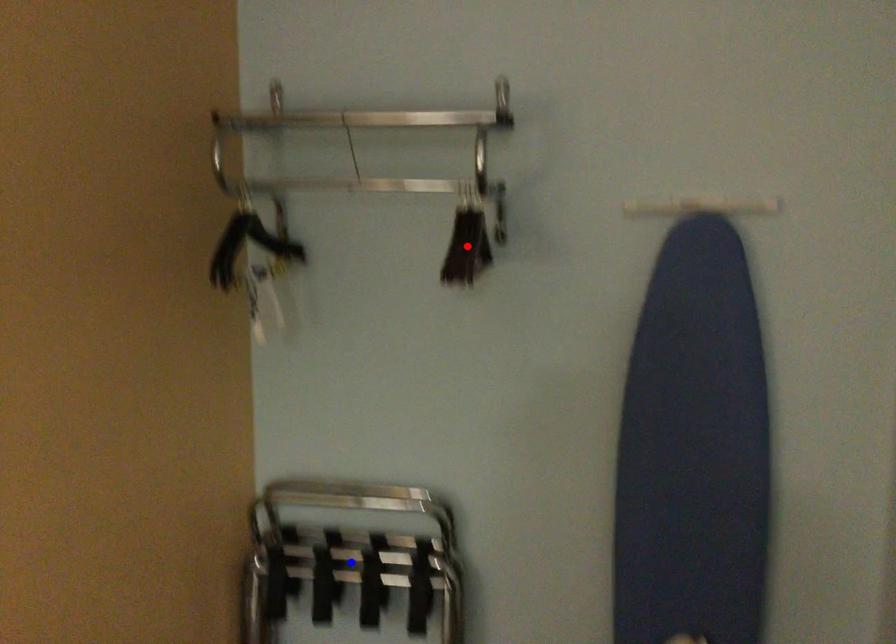
Question: In the image, two points are highlighted. Which point is nearer to the camera? Reply with the corresponding letter.

Choices:
 (A) blue point
 (B) red point

Answer: (B)